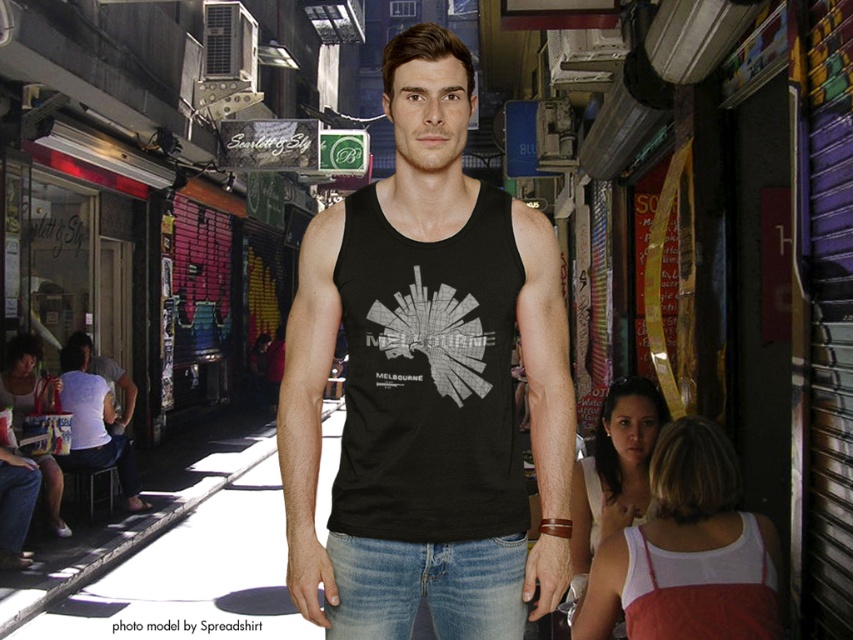
Between black matte tank top at center and denim at center, which one appears on the left side from the viewer's perspective?

denim at center

This screenshot has width=853, height=640. What do you see at coordinates (427, 381) in the screenshot?
I see `black matte tank top at center` at bounding box center [427, 381].

This screenshot has width=853, height=640. I want to click on black matte tank top at center, so click(x=427, y=381).

Between black heather tank top at center and denim at center, which one appears on the left side from the viewer's perspective?

Positioned to the left is denim at center.

Find the location of a particular element. black heather tank top at center is located at coordinates (428, 378).

You are a GUI agent. You are given a task and a screenshot of the screen. Output one action in this format:
    pyautogui.click(x=<x>, y=<y>)
    Task: Click on the black heather tank top at center
    The width and height of the screenshot is (853, 640).
    Given the screenshot: What is the action you would take?
    pyautogui.click(x=428, y=378)

Does black matte tank top at center have a lesser height compared to black heather tank top at center?

Incorrect, black matte tank top at center's height does not fall short of black heather tank top at center's.

Is black matte tank top at center above black heather tank top at center?

Indeed, black matte tank top at center is positioned over black heather tank top at center.

Is point (506, 205) positioned behind point (376, 323)?

Yes, it is behind point (376, 323).

Where is `black matte tank top at center`? This screenshot has width=853, height=640. black matte tank top at center is located at coordinates (427, 381).